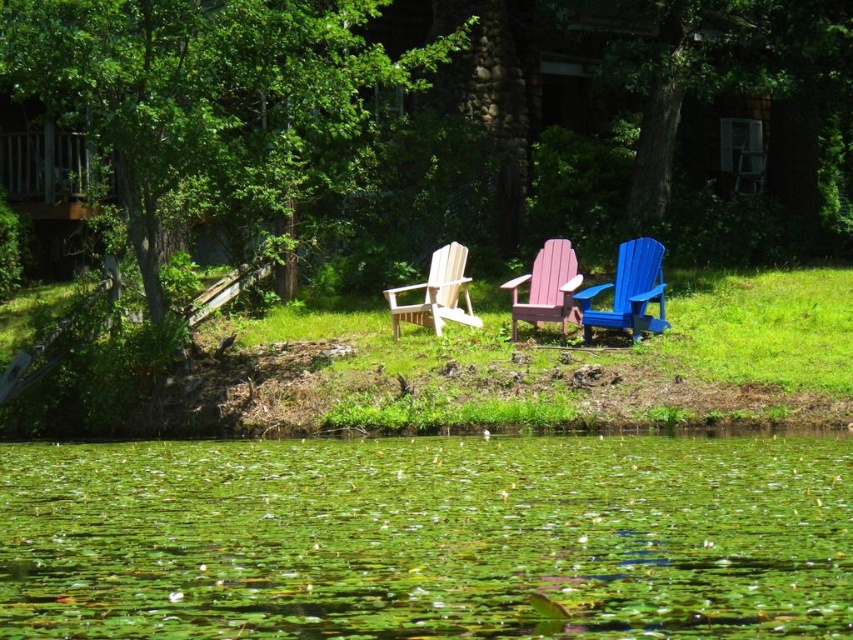
You are standing at the center of the grassy area and want to walk to the water edge. Which direction should you head to reach the green leafy water at lower center?

The green leafy water at lower center is located at point (427, 538), so you should head towards the lower center direction to reach it.

You are sitting in the pink wood beach chair at center and want to look at the green leafy water at lower center. In which direction should you turn your head?

The green leafy water at lower center is positioned on the left side of the pink wood beach chair at center, so you should turn your head to the left to look at it.